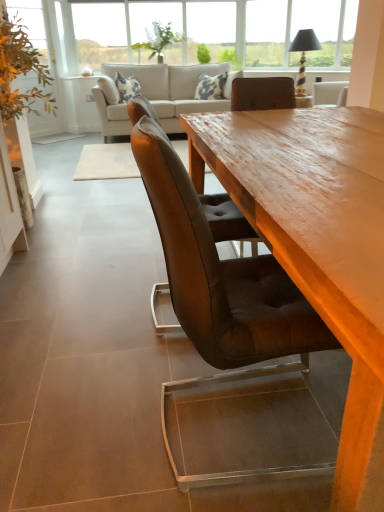
Question: Which direction should I rotate to look at green leafy plant at upper center, which is the 2th plant in right-to-left order, — up or down?

Choices:
 (A) down
 (B) up

Answer: (B)

Question: Is green leafy plant at upper center, the second plant in the left-to-right sequence, a part of matte black lampshade at upper right?

Choices:
 (A) no
 (B) yes

Answer: (A)

Question: Can you confirm if matte black lampshade at upper right is shorter than green leafy plant at upper center, which is the 2th plant in right-to-left order?

Choices:
 (A) no
 (B) yes

Answer: (A)

Question: Is matte black lampshade at upper right touching green leafy plant at upper center, which is the 2th plant in right-to-left order?

Choices:
 (A) yes
 (B) no

Answer: (B)

Question: Is matte black lampshade at upper right oriented towards green leafy plant at upper center, the second plant in the left-to-right sequence?

Choices:
 (A) yes
 (B) no

Answer: (B)

Question: From a real-world perspective, is matte black lampshade at upper right positioned under green leafy plant at upper center, which is the 2th plant in right-to-left order, based on gravity?

Choices:
 (A) no
 (B) yes

Answer: (B)

Question: Is matte black lampshade at upper right to the right of green leafy plant at upper center, which is the 2th plant in right-to-left order, from the viewer's perspective?

Choices:
 (A) no
 (B) yes

Answer: (B)

Question: Is green leafy plant at upper center, the second plant in the left-to-right sequence, outside of beige fabric couch at upper center?

Choices:
 (A) no
 (B) yes

Answer: (B)

Question: From the image's perspective, would you say green leafy plant at upper center, which is the 2th plant in right-to-left order, is shown under beige fabric couch at upper center?

Choices:
 (A) yes
 (B) no

Answer: (B)

Question: Is green leafy plant at upper center, the second plant in the left-to-right sequence, not near beige fabric couch at upper center?

Choices:
 (A) yes
 (B) no

Answer: (B)

Question: Can you confirm if green leafy plant at upper center, the second plant in the left-to-right sequence, is bigger than beige fabric couch at upper center?

Choices:
 (A) yes
 (B) no

Answer: (B)

Question: Is green leafy plant at upper center, which is the 2th plant in right-to-left order, turned away from beige fabric couch at upper center?

Choices:
 (A) yes
 (B) no

Answer: (B)

Question: Considering the relative sizes of green leafy plant at upper center, which is the 2th plant in right-to-left order, and beige fabric couch at upper center in the image provided, is green leafy plant at upper center, which is the 2th plant in right-to-left order, smaller than beige fabric couch at upper center?

Choices:
 (A) yes
 (B) no

Answer: (A)

Question: Is green leafy plant at left, which appears as the third plant when viewed from the right, looking in the opposite direction of brown leather chair at center?

Choices:
 (A) yes
 (B) no

Answer: (B)